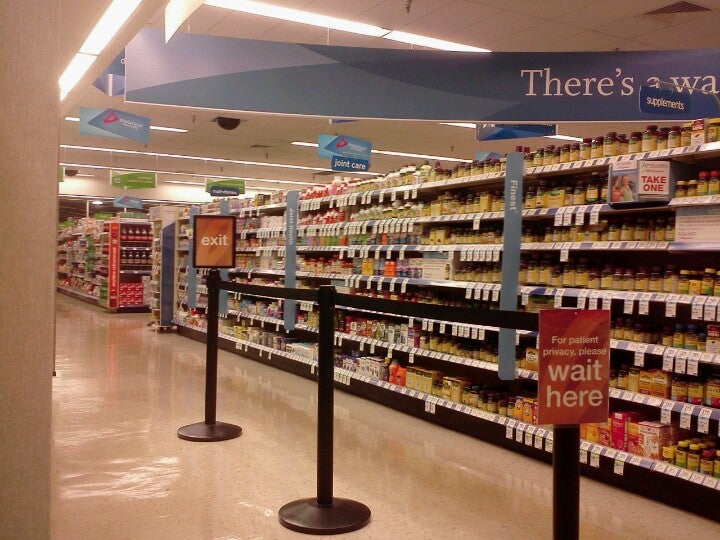
You are a GUI agent. You are given a task and a screenshot of the screen. Output one action in this format:
    pyautogui.click(x=<x>, y=<y>)
    Task: Click on the column
    The height and width of the screenshot is (540, 720).
    Given the screenshot: What is the action you would take?
    pyautogui.click(x=30, y=237)